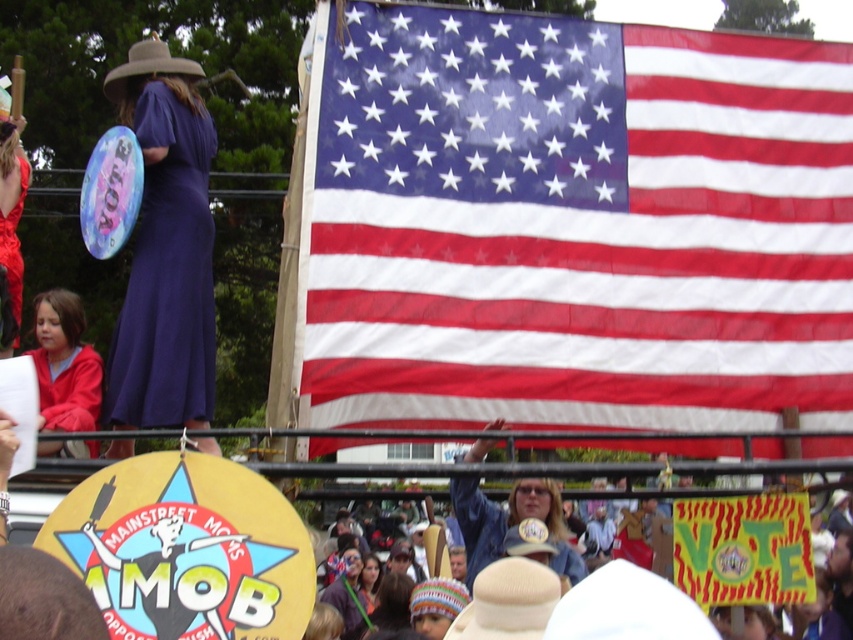
You are a photographer at the rally and want to capture the American flag in your shot. You notice a point marked at coordinates (576, 227). What object at the rally is located at that point?

The point at coordinates (576, 227) corresponds to the red, white, and blue fabric at upper center, which is the American flag.